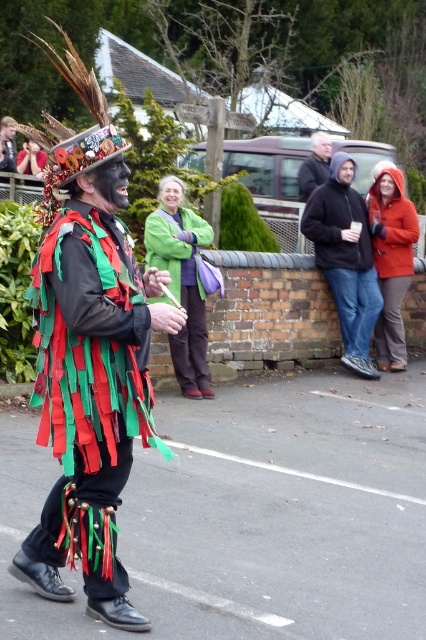
You are standing in the crowd watching the parade and want to locate the black hoodie at center and dark blue jacket at center. According to the scene description, which one is positioned lower?

The black hoodie at center is positioned below dark blue jacket at center, so the black hoodie at center is lower.

You are standing at the origin of the coordinate system in the image. You want to move towards the point that is closer to you. Which point should you choose between the point at (204, 243) and the point at (403, 360)?

Point at (204, 243) is in front of point at (403, 360), so you should choose the point at (204, 243) as it is closer to you.

You are trying to decide whether to place a green fabric bag at center and an orange fuzzy coat at right on a shelf. The shelf has a width of 1.2 meters. Can both items fit side by side without overlapping?

The green fabric bag at center might be wider than orange fuzzy coat at right, so it is uncertain if both can fit on the 1.2 meter shelf without overlapping. Check their exact widths first.